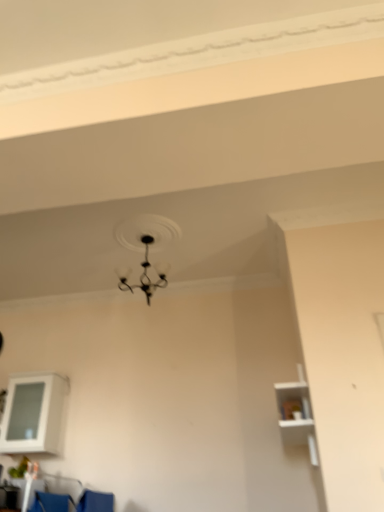
Question: Considering the relative sizes of white glossy cabinet at lower left, marked as the 2th shelf in a front-to-back arrangement, and blue fabric armchair at lower left in the image provided, is white glossy cabinet at lower left, marked as the 2th shelf in a front-to-back arrangement, wider than blue fabric armchair at lower left?

Choices:
 (A) no
 (B) yes

Answer: (B)

Question: Is white glossy cabinet at lower left, the 2th shelf viewed from the right, with blue fabric armchair at lower left?

Choices:
 (A) no
 (B) yes

Answer: (A)

Question: Is white glossy cabinet at lower left, marked as the 2th shelf in a front-to-back arrangement, far away from blue fabric armchair at lower left?

Choices:
 (A) yes
 (B) no

Answer: (B)

Question: From the image's perspective, is white glossy cabinet at lower left, marked as the 2th shelf in a front-to-back arrangement, under blue fabric armchair at lower left?

Choices:
 (A) yes
 (B) no

Answer: (B)

Question: Is white glossy cabinet at lower left, marked as the 1th shelf in a left-to-right arrangement, oriented towards blue fabric armchair at lower left?

Choices:
 (A) yes
 (B) no

Answer: (B)

Question: From a real-world perspective, is black matte chandelier at upper center positioned above or below white glossy cabinet at lower left, which is the first shelf from back to front?

Choices:
 (A) below
 (B) above

Answer: (B)

Question: Which is correct: black matte chandelier at upper center is inside white glossy cabinet at lower left, marked as the 1th shelf in a left-to-right arrangement, or outside of it?

Choices:
 (A) inside
 (B) outside

Answer: (B)

Question: Considering the positions of black matte chandelier at upper center and white glossy cabinet at lower left, marked as the 1th shelf in a left-to-right arrangement, in the image, is black matte chandelier at upper center taller or shorter than white glossy cabinet at lower left, marked as the 1th shelf in a left-to-right arrangement,?

Choices:
 (A) short
 (B) tall

Answer: (A)

Question: Relative to white glossy cabinet at lower left, marked as the 1th shelf in a left-to-right arrangement, is black matte chandelier at upper center in front or behind?

Choices:
 (A) behind
 (B) front

Answer: (B)

Question: Looking at their shapes, would you say blue fabric armchair at lower left is wider or thinner than black matte chandelier at upper center?

Choices:
 (A) thin
 (B) wide

Answer: (A)

Question: Does point (33, 505) appear closer or farther from the camera than point (148, 284)?

Choices:
 (A) closer
 (B) farther

Answer: (A)

Question: Is blue fabric armchair at lower left in front of or behind black matte chandelier at upper center in the image?

Choices:
 (A) front
 (B) behind

Answer: (A)

Question: In the image, is blue fabric armchair at lower left on the left side or the right side of black matte chandelier at upper center?

Choices:
 (A) right
 (B) left

Answer: (B)

Question: Is black matte chandelier at upper center taller or shorter than white matte shelf at right, which is the first shelf in right-to-left order?

Choices:
 (A) tall
 (B) short

Answer: (B)

Question: From the image's perspective, is black matte chandelier at upper center above or below white matte shelf at right, the second shelf when ordered from left to right?

Choices:
 (A) above
 (B) below

Answer: (A)